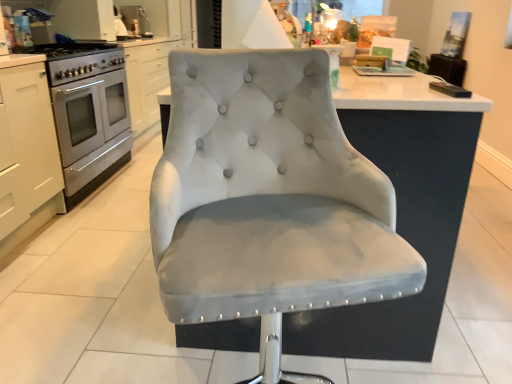
The image size is (512, 384). What do you see at coordinates (268, 199) in the screenshot?
I see `suede-like gray chair at center` at bounding box center [268, 199].

The height and width of the screenshot is (384, 512). I want to click on satin silver gas stove at left, so click(77, 60).

Find the location of a particular element. satin silver oven at left is located at coordinates (90, 119).

Which object is closer to the camera taking this photo, satin silver oven at left or satin silver gas stove at left?

satin silver gas stove at left is more forward.

Could you tell me if satin silver oven at left is turned towards satin silver gas stove at left?

No, satin silver oven at left is not facing towards satin silver gas stove at left.

How far apart are satin silver oven at left and white matte cabinet at left?

satin silver oven at left and white matte cabinet at left are 14.89 inches apart.

Considering the sizes of objects satin silver oven at left and white matte cabinet at left in the image provided, who is smaller, satin silver oven at left or white matte cabinet at left?

white matte cabinet at left.

From a real-world perspective, is satin silver oven at left located higher than white matte cabinet at left?

No, from a real-world perspective, satin silver oven at left is not on top of white matte cabinet at left.

Is white matte cabinet at left to the left or to the right of suede-like gray chair at center in the image?

From the image, it's evident that white matte cabinet at left is to the left of suede-like gray chair at center.

From the image's perspective, is white matte cabinet at left located above or below suede-like gray chair at center?

From the image's perspective, white matte cabinet at left appears above suede-like gray chair at center.

Which of these two, white matte cabinet at left or suede-like gray chair at center, is wider?

suede-like gray chair at center is wider.

Is satin silver gas stove at left oriented away from suede-like gray chair at center?

That's not correct — satin silver gas stove at left is not looking away from suede-like gray chair at center.

From the image's perspective, which one is positioned higher, satin silver gas stove at left or suede-like gray chair at center?

satin silver gas stove at left appears higher in the image.

Which object is wider, satin silver gas stove at left or suede-like gray chair at center?

Wider between the two is suede-like gray chair at center.

From a real-world perspective, is satin silver gas stove at left over suede-like gray chair at center?

Indeed, from a real-world perspective, satin silver gas stove at left stands above suede-like gray chair at center.

Is white matte cabinet at left positioned with its back to satin silver oven at left?

No, white matte cabinet at left's orientation is not away from satin silver oven at left.

Is white matte cabinet at left inside or outside of satin silver oven at left?

white matte cabinet at left is outside satin silver oven at left.

The image size is (512, 384). Identify the location of oven above the white matte cabinet at left (from the image's perspective). (90, 119).

From a real-world perspective, who is located lower, white matte cabinet at left or satin silver oven at left?

satin silver oven at left.

Is suede-like gray chair at center positioned behind satin silver oven at left?

No, suede-like gray chair at center is closer to the viewer.

From the image's perspective, would you say suede-like gray chair at center is shown under satin silver oven at left?

Correct, suede-like gray chair at center appears lower than satin silver oven at left in the image.

Is point (280, 280) closer or farther from the camera than point (71, 113)?

Clearly, point (280, 280) is closer to the camera than point (71, 113).

Is suede-like gray chair at center to the left or to the right of satin silver oven at left in the image?

From the image, it's evident that suede-like gray chair at center is to the right of satin silver oven at left.

Is suede-like gray chair at center far from satin silver gas stove at left?

Yes, suede-like gray chair at center and satin silver gas stove at left are located far from each other.

Is suede-like gray chair at center facing towards satin silver gas stove at left?

No, suede-like gray chair at center is not turned towards satin silver gas stove at left.

Does suede-like gray chair at center appear on the right side of satin silver gas stove at left?

Correct, you'll find suede-like gray chair at center to the right of satin silver gas stove at left.

Does point (217, 57) lie behind point (72, 72)?

That is False.

The width and height of the screenshot is (512, 384). In order to click on gas stove above the satin silver oven at left (from a real-world perspective) in this screenshot , I will do `click(77, 60)`.

This screenshot has height=384, width=512. In order to click on cabinetry in front of the satin silver oven at left in this screenshot , I will do `click(27, 151)`.

When comparing their distances from white matte cabinet at left, does satin silver oven at left or suede-like gray chair at center seem further?

suede-like gray chair at center is positioned further to the anchor white matte cabinet at left.

Considering their positions, is satin silver gas stove at left positioned closer to white matte cabinet at left than satin silver oven at left?

satin silver oven at left.

Considering their positions, is white matte cabinet at left positioned closer to satin silver gas stove at left than suede-like gray chair at center?

white matte cabinet at left lies closer to satin silver gas stove at left than the other object.

In the scene shown: Based on their spatial positions, is white matte cabinet at left or satin silver gas stove at left further from satin silver oven at left?

Among the two, white matte cabinet at left is located further to satin silver oven at left.

Based on their spatial positions, is satin silver oven at left or suede-like gray chair at center closer to satin silver gas stove at left?

Based on the image, satin silver oven at left appears to be nearer to satin silver gas stove at left.

Based on the photo, from the image, which object appears to be farther from white matte cabinet at left, suede-like gray chair at center or satin silver oven at left?

Based on the image, suede-like gray chair at center appears to be further to white matte cabinet at left.

Which object lies nearer to the anchor point white matte cabinet at left, satin silver oven at left or satin silver gas stove at left?

Based on the image, satin silver oven at left appears to be nearer to white matte cabinet at left.

Looking at the image, which one is located closer to suede-like gray chair at center, satin silver gas stove at left or white matte cabinet at left?

The object closer to suede-like gray chair at center is white matte cabinet at left.

This screenshot has width=512, height=384. What are the coordinates of `cabinetry between suede-like gray chair at center and satin silver gas stove at left from front to back` in the screenshot? It's located at (27, 151).

Image resolution: width=512 pixels, height=384 pixels. In order to click on gas stove between white matte cabinet at left and satin silver oven at left along the z-axis in this screenshot , I will do `click(77, 60)`.

Image resolution: width=512 pixels, height=384 pixels. In order to click on cabinetry between suede-like gray chair at center and satin silver oven at left in the front-back direction in this screenshot , I will do `click(27, 151)`.

The image size is (512, 384). What are the coordinates of `gas stove between suede-like gray chair at center and satin silver oven at left from front to back` in the screenshot? It's located at (77, 60).